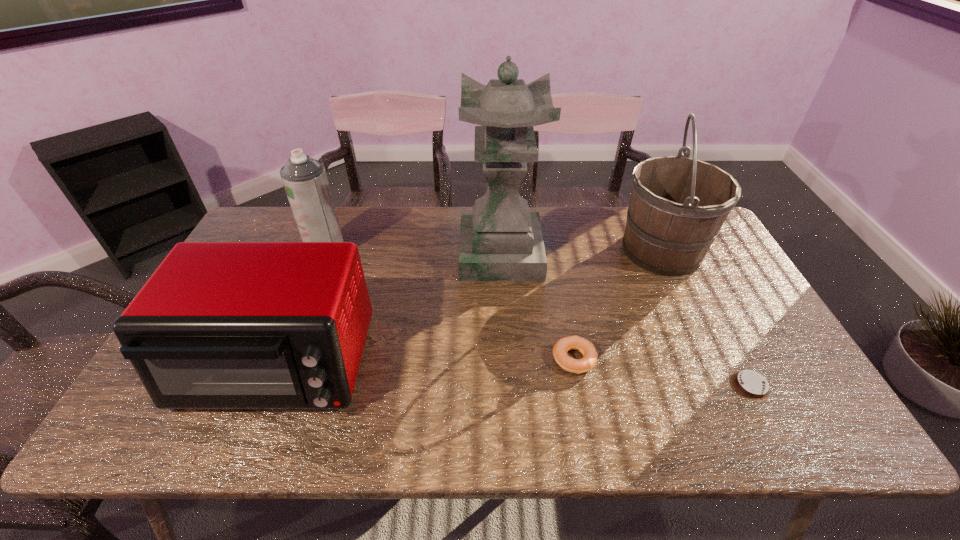
Where is `vacant area that lies between the sculpture and the fifth tallest object`? The image size is (960, 540). vacant area that lies between the sculpture and the fifth tallest object is located at coordinates (538, 306).

You are a GUI agent. You are given a task and a screenshot of the screen. Output one action in this format:
    pyautogui.click(x=<x>, y=<y>)
    Task: Click on the empty location between the bagel and the third shortest object
    
    Given the screenshot: What is the action you would take?
    pyautogui.click(x=425, y=362)

Image resolution: width=960 pixels, height=540 pixels. Find the location of `vacant space that's between the bagel and the toaster oven`. vacant space that's between the bagel and the toaster oven is located at coordinates (425, 362).

The image size is (960, 540). I want to click on free area in between the toaster oven and the sculpture, so click(x=389, y=309).

Select which object is the second closest to the shortest object. Please provide its 2D coordinates. Your answer should be formatted as a tuple, i.e. [(x, y)], where the tuple contains the x and y coordinates of a point satisfying the conditions above.

[(678, 205)]

Identify which object is located as the second nearest to the shortest object. Please provide its 2D coordinates. Your answer should be formatted as a tuple, i.e. [(x, y)], where the tuple contains the x and y coordinates of a point satisfying the conditions above.

[(678, 205)]

At what (x,y) coordinates should I click in order to perform the action: click on vacant position in the image that satisfies the following two spatial constraints: 1. on the front side of the third tallest object; 2. on the left side of the fifth tallest object. Please return your answer as a coordinate pair (x, y). The image size is (960, 540). Looking at the image, I should click on (284, 359).

The width and height of the screenshot is (960, 540). Find the location of `vacant space that satisfies the following two spatial constraints: 1. at the front opening of the sculpture; 2. on the left side of the second shortest object`. vacant space that satisfies the following two spatial constraints: 1. at the front opening of the sculpture; 2. on the left side of the second shortest object is located at coordinates (506, 359).

At what (x,y) coordinates should I click in order to perform the action: click on vacant region that satisfies the following two spatial constraints: 1. on the front side of the chocolate cake; 2. on the right side of the third tallest object. Please return your answer as a coordinate pair (x, y). The image size is (960, 540). Looking at the image, I should click on (274, 386).

Locate an element on the screen. The image size is (960, 540). vacant area in the image that satisfies the following two spatial constraints: 1. at the front opening of the tallest object; 2. on the front-facing side of the fourth tallest object is located at coordinates (507, 364).